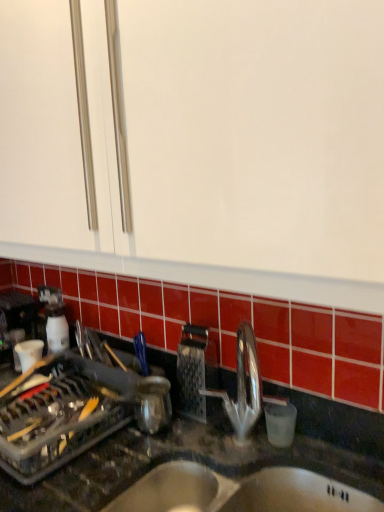
Where is `black granite countertop at center`? The image size is (384, 512). black granite countertop at center is located at coordinates (208, 458).

Image resolution: width=384 pixels, height=512 pixels. Describe the element at coordinates (192, 371) in the screenshot. I see `metallic grater at center` at that location.

The width and height of the screenshot is (384, 512). Identify the location of black granite countertop at center. (208, 458).

Can you confirm if stainless steel sink at lower center is bigger than metallic grater at center?

Indeed, stainless steel sink at lower center has a larger size compared to metallic grater at center.

Locate an element on the screen. appliance located behind the stainless steel sink at lower center is located at coordinates (192, 371).

Consider the image. Considering the positions of objects stainless steel sink at lower center and metallic grater at center in the image provided, who is more to the right, stainless steel sink at lower center or metallic grater at center?

From the viewer's perspective, stainless steel sink at lower center appears more on the right side.

Which object is closer to the camera taking this photo, stainless steel sink at lower center or metallic grater at center?

stainless steel sink at lower center is more forward.

Considering the relative sizes of metallic grater at center and black granite countertop at center in the image provided, is metallic grater at center wider than black granite countertop at center?

Incorrect, the width of metallic grater at center does not surpass that of black granite countertop at center.

Based on the photo, is metallic grater at center facing away from black granite countertop at center?

No.

What's the angular difference between metallic grater at center and black granite countertop at center's facing directions?

There is a 0.294-degree angle between the facing directions of metallic grater at center and black granite countertop at center.

From a real-world perspective, which is physically above, metallic grater at center or black granite countertop at center?

In real-world perspective, metallic grater at center is above.

Does stainless steel sink at lower center have a greater height compared to black granite countertop at center?

Incorrect, the height of stainless steel sink at lower center is not larger of that of black granite countertop at center.

Could you tell me if stainless steel sink at lower center is facing black granite countertop at center?

Yes, stainless steel sink at lower center faces towards black granite countertop at center.

The height and width of the screenshot is (512, 384). Identify the location of sink located on the right of black granite countertop at center. (239, 490).

Is stainless steel sink at lower center surrounding black granite countertop at center?

No, black granite countertop at center is not inside stainless steel sink at lower center.

Considering the sizes of objects black granite countertop at center and stainless steel sink at lower center in the image provided, who is shorter, black granite countertop at center or stainless steel sink at lower center?

Standing shorter between the two is stainless steel sink at lower center.

Considering the positions of point (121, 478) and point (317, 482), is point (121, 478) closer or farther from the camera than point (317, 482)?

Point (121, 478) appears to be closer to the viewer than point (317, 482).

From a real-world perspective, relative to stainless steel sink at lower center, is black granite countertop at center vertically above or below?

black granite countertop at center is above stainless steel sink at lower center.

Can you tell me how much black granite countertop at center and stainless steel sink at lower center differ in facing direction?

0.295 degrees separate the facing orientations of black granite countertop at center and stainless steel sink at lower center.

At what (x,y) coordinates should I click in order to perform the action: click on appliance that is above the stainless steel sink at lower center (from the image's perspective). Please return your answer as a coordinate pair (x, y). Looking at the image, I should click on (192, 371).

Which is in front, point (194, 408) or point (296, 468)?

The point (296, 468) is more forward.

From a real-world perspective, is metallic grater at center above or below stainless steel sink at lower center?

In terms of real-world spatial position, metallic grater at center is above stainless steel sink at lower center.

Is black granite countertop at center facing away from metallic grater at center?

No, black granite countertop at center is not facing away from metallic grater at center.

The height and width of the screenshot is (512, 384). In the image, there is a metallic grater at center. Find the location of `countertop below it (from the image's perspective)`. countertop below it (from the image's perspective) is located at coordinates (208, 458).

From the image's perspective, is black granite countertop at center located beneath metallic grater at center?

Yes, from the image's perspective, black granite countertop at center is below metallic grater at center.

Is black granite countertop at center in front of or behind metallic grater at center in the image?

black granite countertop at center is in front of metallic grater at center.

Identify the location of appliance above the stainless steel sink at lower center (from a real-world perspective). Image resolution: width=384 pixels, height=512 pixels. (192, 371).

Identify the location of appliance on the right of the black granite countertop at center. This screenshot has height=512, width=384. (192, 371).

Considering their positions, is stainless steel sink at lower center positioned closer to black granite countertop at center than metallic grater at center?

stainless steel sink at lower center is closer to black granite countertop at center.

Considering their positions, is metallic grater at center positioned further to stainless steel sink at lower center than black granite countertop at center?

metallic grater at center is positioned further to the anchor stainless steel sink at lower center.

Based on their spatial positions, is black granite countertop at center or stainless steel sink at lower center further from metallic grater at center?

Among the two, stainless steel sink at lower center is located further to metallic grater at center.

Considering their positions, is stainless steel sink at lower center positioned further to metallic grater at center than black granite countertop at center?

stainless steel sink at lower center is positioned further to the anchor metallic grater at center.

Estimate the real-world distances between objects in this image. Which object is further from stainless steel sink at lower center, black granite countertop at center or metallic grater at center?

The object further to stainless steel sink at lower center is metallic grater at center.

Which object lies further to the anchor point black granite countertop at center, metallic grater at center or stainless steel sink at lower center?

The object further to black granite countertop at center is metallic grater at center.

I want to click on sink located between black granite countertop at center and metallic grater at center in the depth direction, so [x=239, y=490].